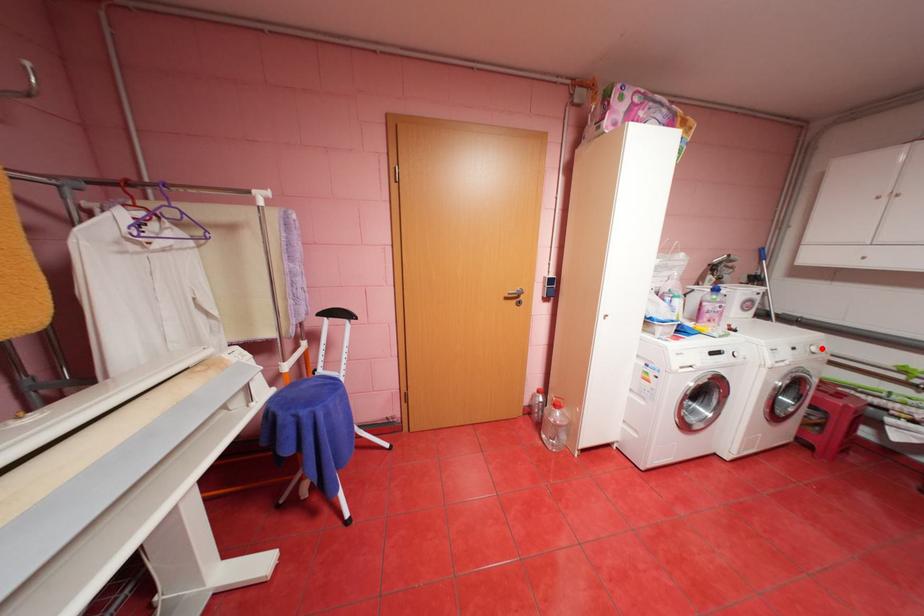
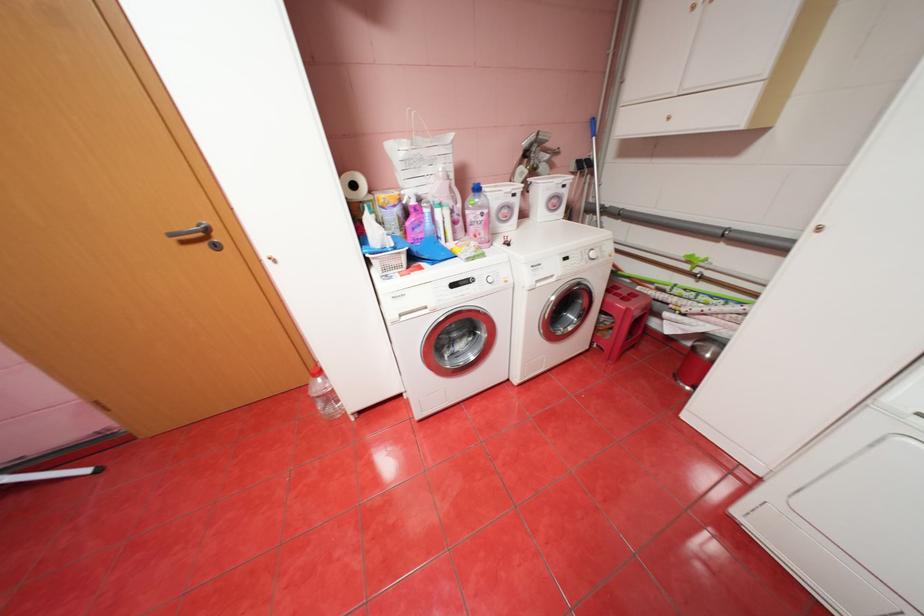
Where in the second image is the point corresponding to the highlighted location from the first image?

(602, 254)